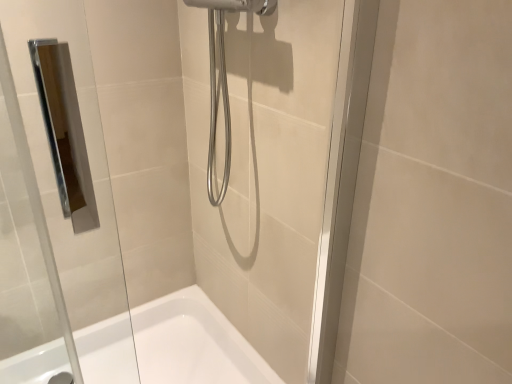
Question: Is white glossy bathtub at lower center in front of transparent glass door at center?

Choices:
 (A) no
 (B) yes

Answer: (A)

Question: Is transparent glass door at center inside white glossy bathtub at lower center?

Choices:
 (A) yes
 (B) no

Answer: (B)

Question: From the image's perspective, is white glossy bathtub at lower center located beneath transparent glass door at center?

Choices:
 (A) yes
 (B) no

Answer: (A)

Question: Can you confirm if white glossy bathtub at lower center is thinner than transparent glass door at center?

Choices:
 (A) yes
 (B) no

Answer: (B)

Question: Is white glossy bathtub at lower center touching transparent glass door at center?

Choices:
 (A) no
 (B) yes

Answer: (A)

Question: Is white glossy bathtub at lower center aimed at transparent glass door at center?

Choices:
 (A) yes
 (B) no

Answer: (B)

Question: Is transparent glass door at center oriented away from white glossy bathtub at lower center?

Choices:
 (A) yes
 (B) no

Answer: (A)

Question: Considering the relative sizes of transparent glass door at center and white glossy bathtub at lower center in the image provided, is transparent glass door at center bigger than white glossy bathtub at lower center?

Choices:
 (A) yes
 (B) no

Answer: (B)

Question: Does transparent glass door at center have a greater height compared to white glossy bathtub at lower center?

Choices:
 (A) no
 (B) yes

Answer: (B)

Question: Is the surface of transparent glass door at center in direct contact with white glossy bathtub at lower center?

Choices:
 (A) yes
 (B) no

Answer: (B)

Question: Does transparent glass door at center appear on the right side of white glossy bathtub at lower center?

Choices:
 (A) yes
 (B) no

Answer: (A)

Question: From a real-world perspective, is transparent glass door at center physically below white glossy bathtub at lower center?

Choices:
 (A) yes
 (B) no

Answer: (B)

Question: Would you say white glossy bathtub at lower center is to the left or to the right of transparent glass door at center in the picture?

Choices:
 (A) right
 (B) left

Answer: (B)